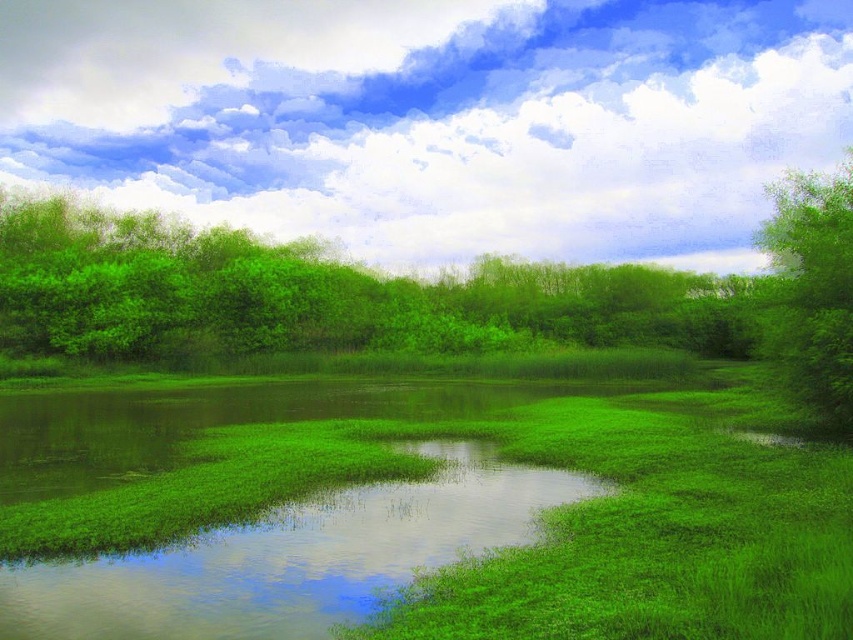
You are standing in the middle of the green grassy water at center and want to reach the green leafy tree at right. Which direction should you move to get closer to the tree?

The green grassy water at center is smaller than the green leafy tree at right, so to reach the tree, you should move towards the right direction where the tree is located.

You are standing in the middle of the grassy area and see the green leafy trees at upper center and the green leafy tree at right. Which tree is located to the right of the other?

The green leafy trees at upper center is positioned on the left side of green leafy tree at right, so the green leafy tree at right is to the right of the green leafy trees at upper center.